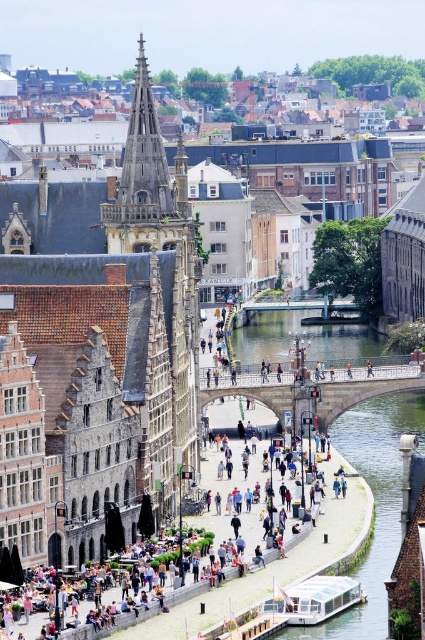
Who is higher up, clear water at bridge center or matte brown building at center?

clear water at bridge center

Image resolution: width=425 pixels, height=640 pixels. What do you see at coordinates (376, 504) in the screenshot?
I see `clear water at bridge center` at bounding box center [376, 504].

Locate an element on the screen. Image resolution: width=425 pixels, height=640 pixels. clear water at bridge center is located at coordinates (376, 504).